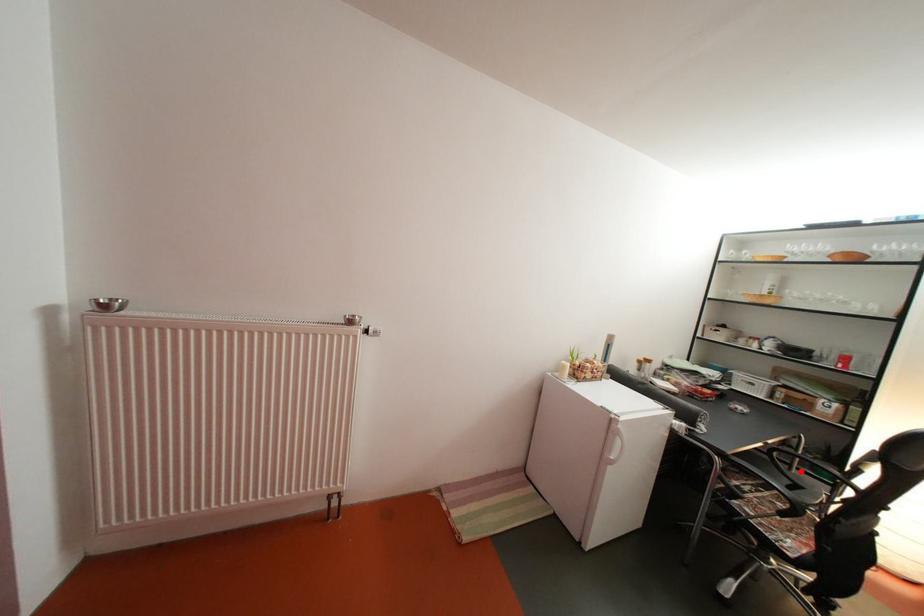
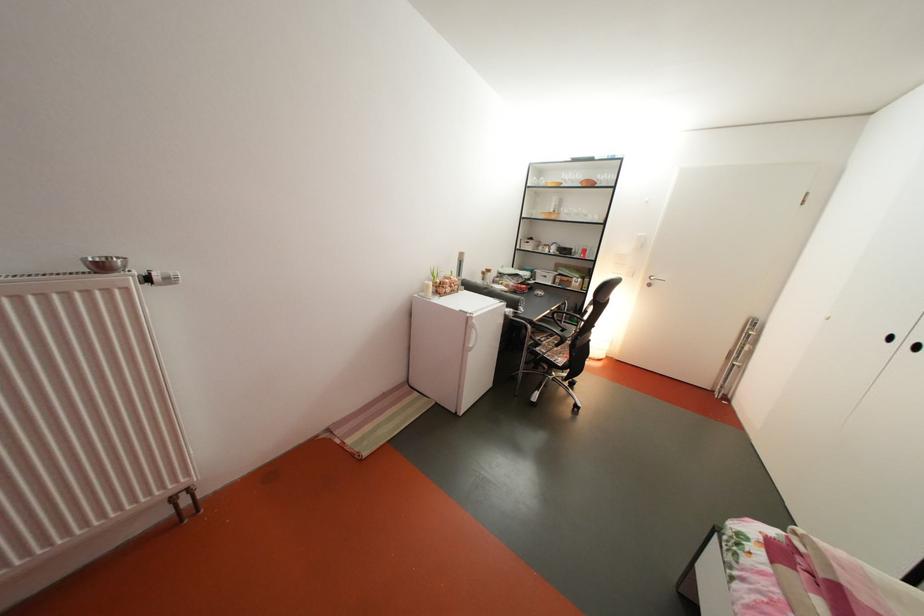
The point at the highlighted location is marked in the first image. Where is the corresponding point in the second image?

(573, 328)